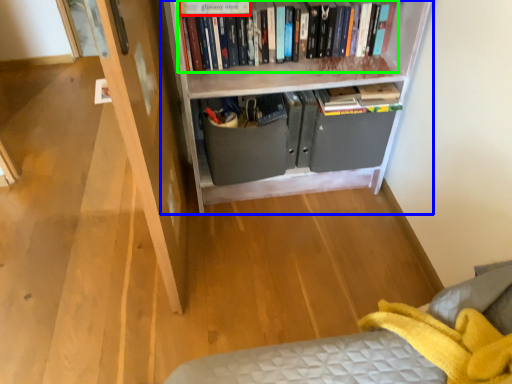
Question: Estimate the real-world distances between objects in this image. Which object is closer to paperback book (highlighted by a red box), bookcase (highlighted by a blue box) or book (highlighted by a green box)?

Choices:
 (A) bookcase
 (B) book

Answer: (B)